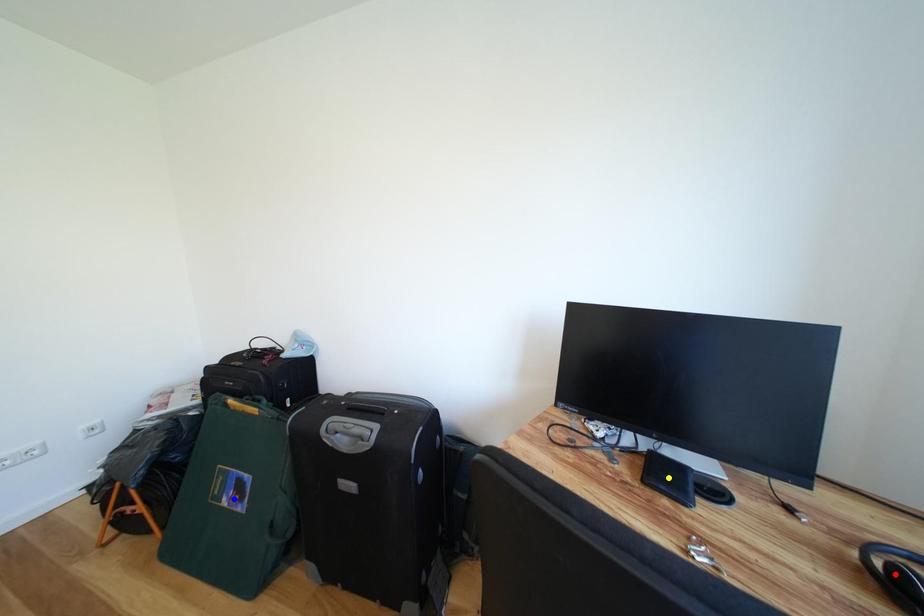
Order these from nearest to farthest:
1. blue point
2. red point
3. yellow point

blue point
yellow point
red point